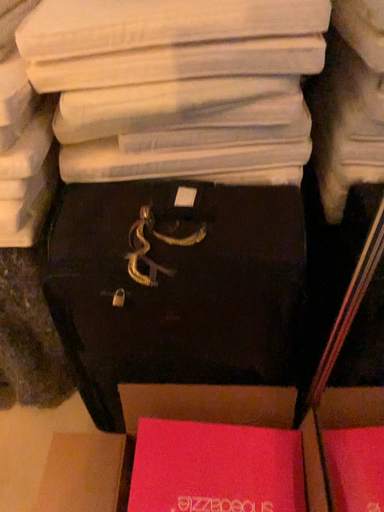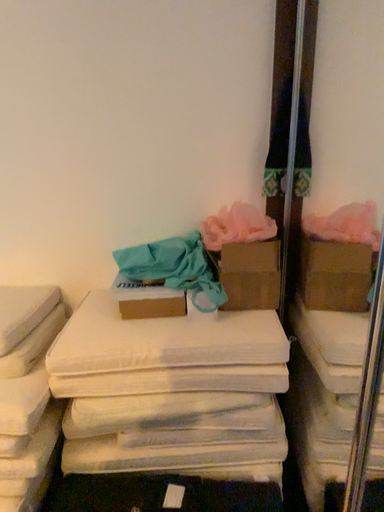
Question: How did the camera likely rotate when shooting the video?

Choices:
 (A) rotated downward
 (B) rotated upward

Answer: (B)